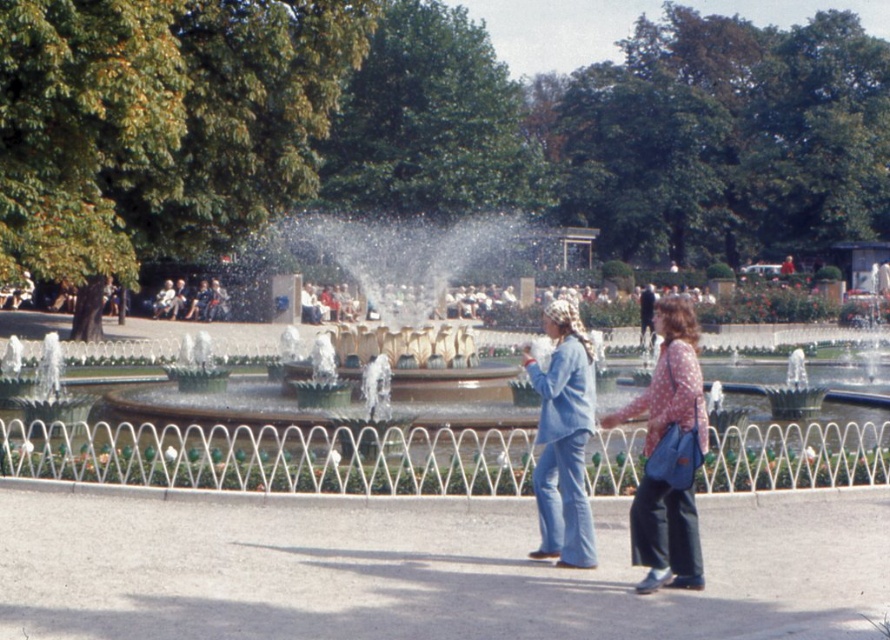
Question: Which point is closer to the camera taking this photo?

Choices:
 (A) (670, 576)
 (B) (568, 451)

Answer: (A)

Question: Which object is the closest to the polka dot fabric blouse at center?

Choices:
 (A) denim jacket at center
 (B) matte black jacket at center

Answer: (A)

Question: Among these points, which one is farthest from the camera?

Choices:
 (A) (677, 385)
 (B) (213, 280)

Answer: (B)

Question: Can you confirm if polka dot fabric blouse at center is positioned below matte black jacket at center?

Choices:
 (A) no
 (B) yes

Answer: (B)

Question: Does denim jacket at center appear on the left side of matte black jacket at center?

Choices:
 (A) yes
 (B) no

Answer: (B)

Question: From the image, what is the correct spatial relationship of polka dot fabric blouse at center in relation to matte black jacket at center?

Choices:
 (A) right
 (B) left

Answer: (A)